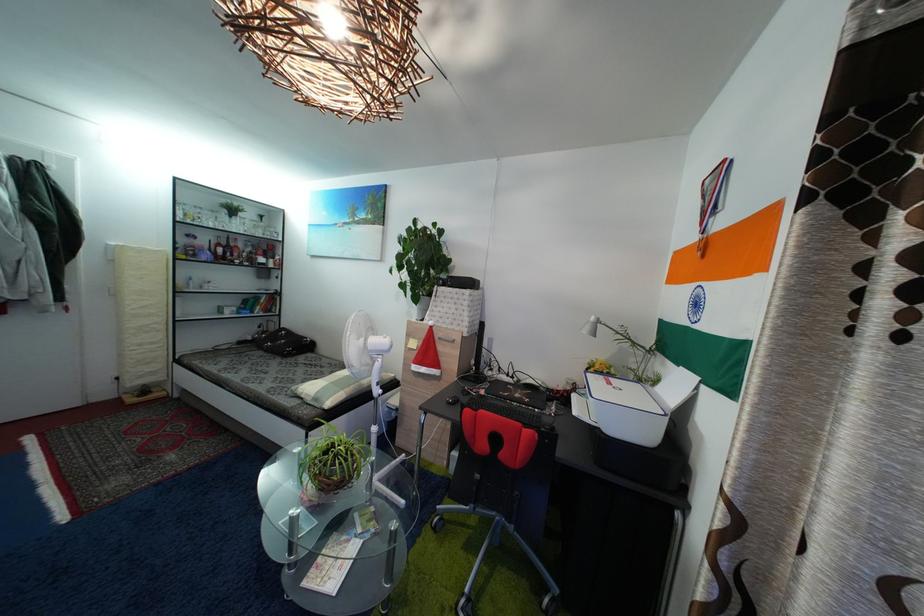
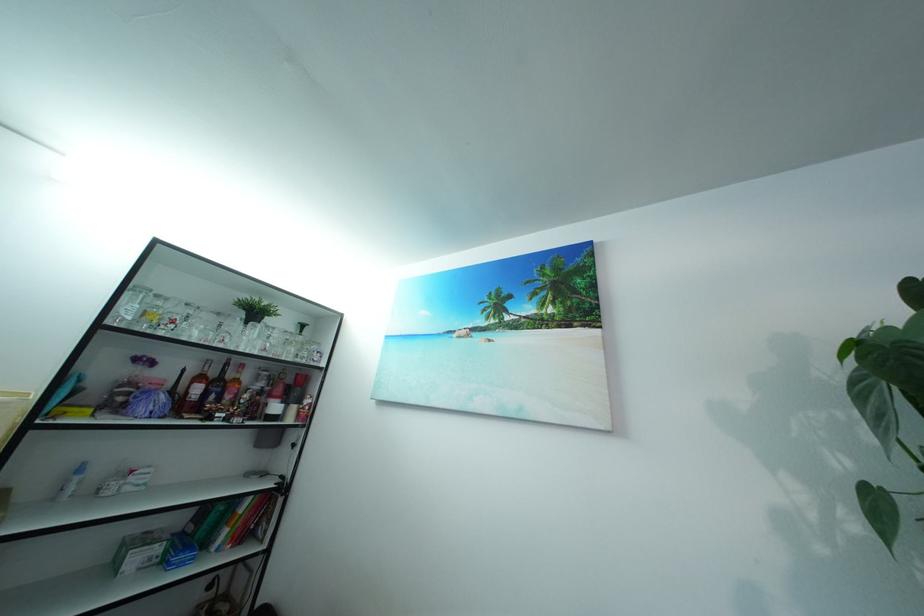
Where in the second image is the point corresponding to pixel 233 251 from the first image?

(222, 381)